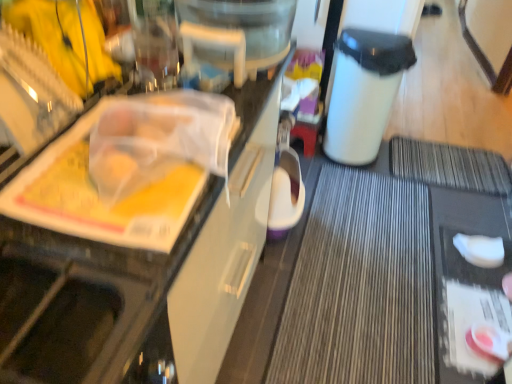
Where is `vacant space behind pink glossy jar at lower right, the second food in the top-to-bottom sequence`? vacant space behind pink glossy jar at lower right, the second food in the top-to-bottom sequence is located at coordinates (475, 311).